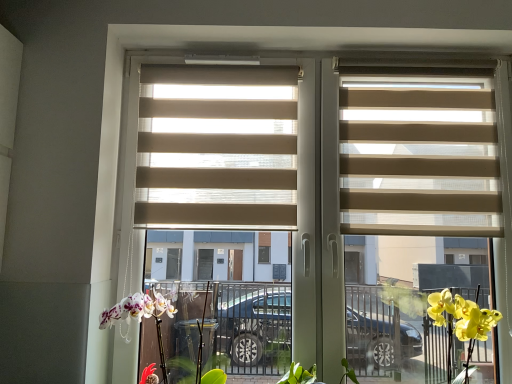
Question: From a real-world perspective, is beige fabric blinds at center, the 1th window blind viewed from the left, physically located above or below beige fabric blinds at center?

Choices:
 (A) above
 (B) below

Answer: (A)

Question: Based on their sizes in the image, would you say beige fabric blinds at center, the 2th window blind from the right, is bigger or smaller than beige fabric blinds at center?

Choices:
 (A) small
 (B) big

Answer: (A)

Question: Based on their relative distances, which object is nearer to the white matte orchid at lower left?

Choices:
 (A) beige fabric blinds at center
 (B) beige fabric blinds at center, the 1th window blind viewed from the left
 (C) beige fabric blinds at right, marked as the first window blind in a right-to-left arrangement

Answer: (B)

Question: Which is farther from the beige fabric blinds at center?

Choices:
 (A) white matte orchid at lower left
 (B) beige fabric blinds at right, placed as the second window blind when sorted from left to right
 (C) beige fabric blinds at center, the 1th window blind viewed from the left

Answer: (A)